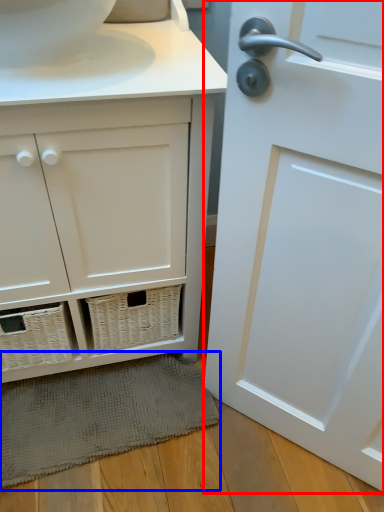
Question: Which object appears farthest to the camera in this image, door (highlighted by a red box) or bath mat (highlighted by a blue box)?

Choices:
 (A) door
 (B) bath mat

Answer: (B)